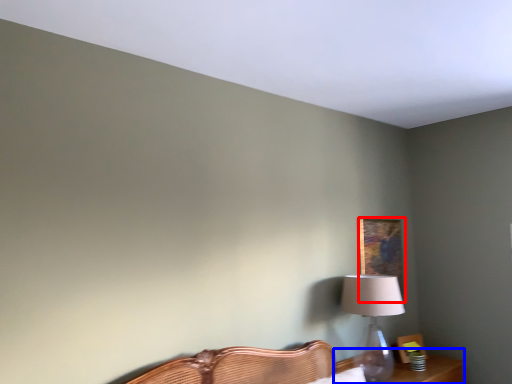
Question: Among these objects, which one is nearest to the camera, picture frame (highlighted by a red box) or table (highlighted by a blue box)?

Choices:
 (A) picture frame
 (B) table

Answer: (B)